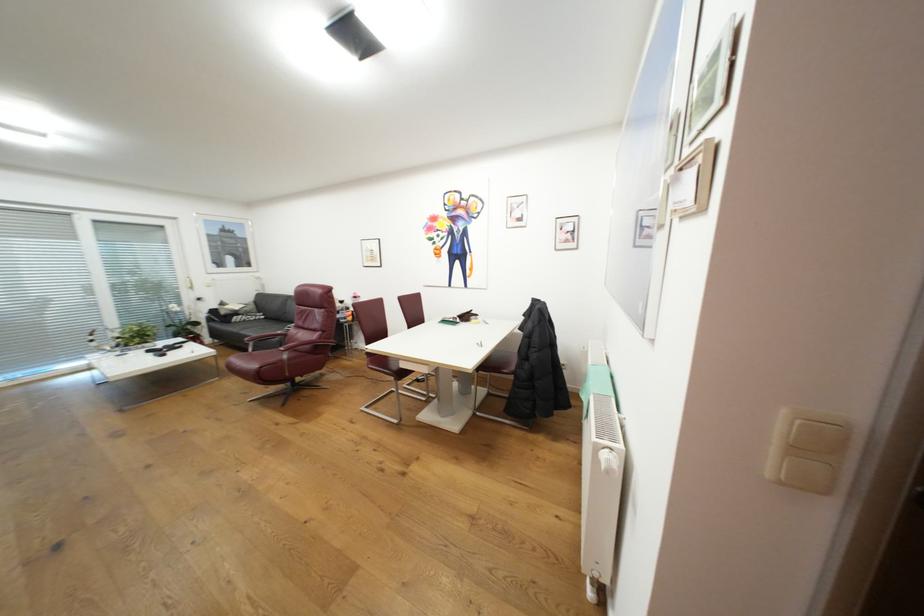
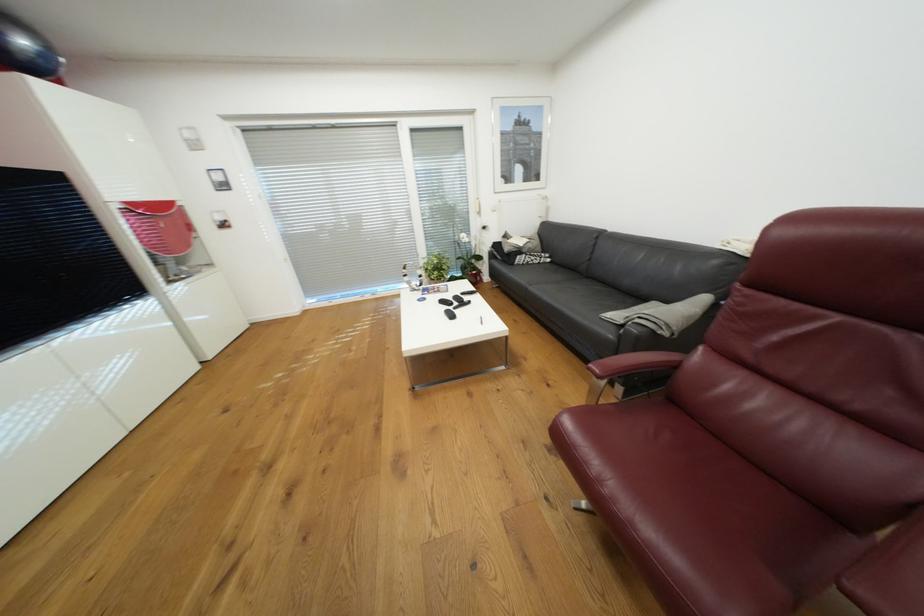
In the second image, find the point that corresponds to [143,339] in the first image.

(443, 273)